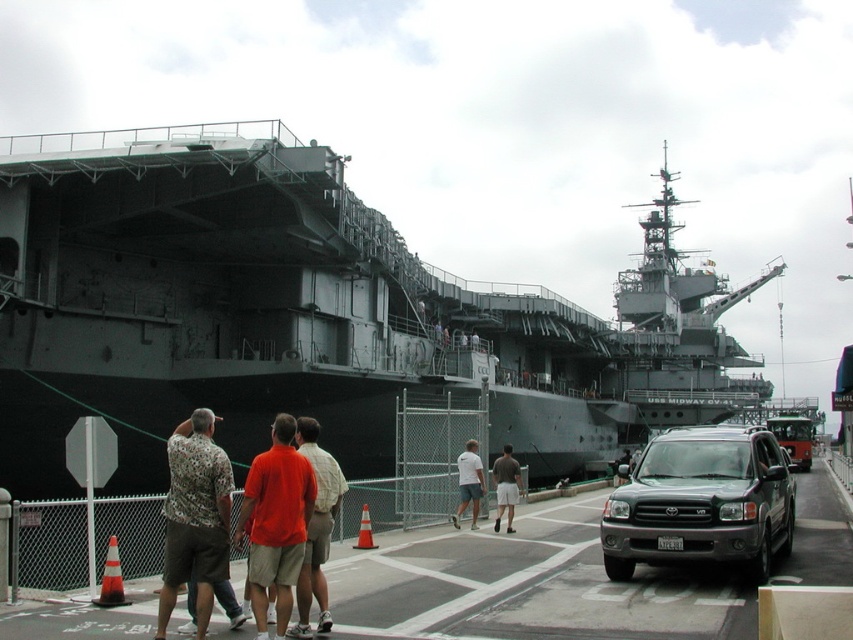
Measure the distance between point [312,422] and camera.

Point [312,422] and camera are 24.72 meters apart from each other.

Who is higher up, orange shirt at center or white cotton shirt at center?

orange shirt at center is above.

Which is in front, point (320, 448) or point (473, 442)?

Positioned in front is point (473, 442).

Image resolution: width=853 pixels, height=640 pixels. Identify the location of orange shirt at center. (316, 529).

Is gray metallic ship at center further to camera compared to orange t-shirt at center?

That is True.

Does gray metallic ship at center have a greater width compared to orange t-shirt at center?

Correct, the width of gray metallic ship at center exceeds that of orange t-shirt at center.

Between point (366, 273) and point (288, 477), which one is positioned behind?

Positioned behind is point (366, 273).

Where is `gray metallic ship at center`? This screenshot has height=640, width=853. gray metallic ship at center is located at coordinates (309, 312).

Does gray metallic ship at center lie in front of dark gray shirt at center?

No, gray metallic ship at center is behind dark gray shirt at center.

Does gray metallic ship at center appear under dark gray shirt at center?

No, gray metallic ship at center is not below dark gray shirt at center.

Does point (381, 268) lie behind point (616, 461)?

No, (381, 268) is closer to viewer.

Locate an element on the screen. This screenshot has height=640, width=853. gray metallic ship at center is located at coordinates (309, 312).